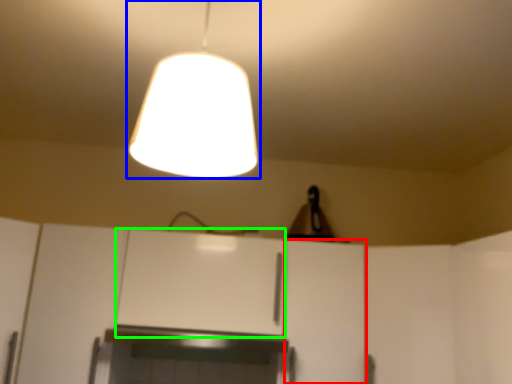
Question: Based on their relative distances, which object is nearer to cabinetry (highlighted by a red box)? Choose from lamp (highlighted by a blue box) and cabinetry (highlighted by a green box).

Choices:
 (A) lamp
 (B) cabinetry

Answer: (B)